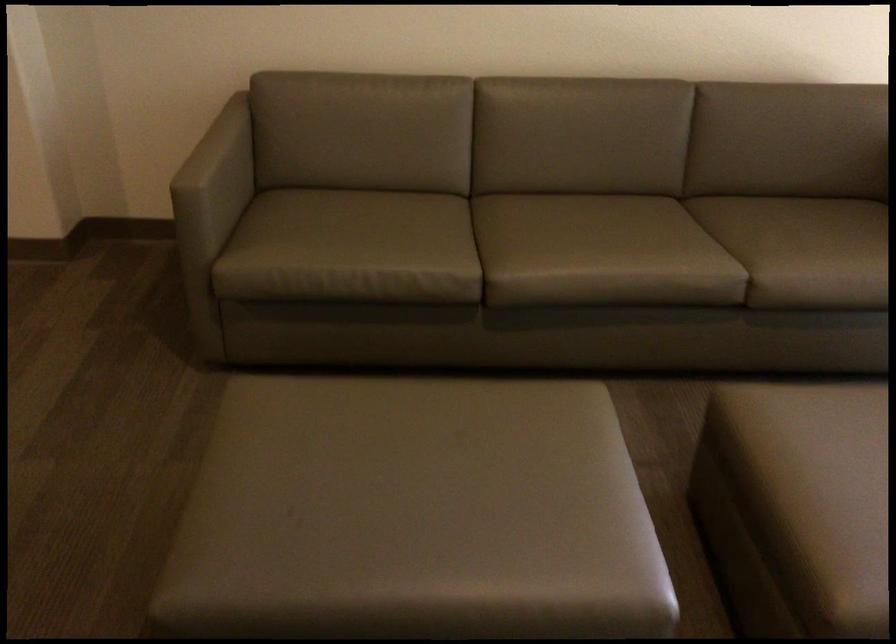
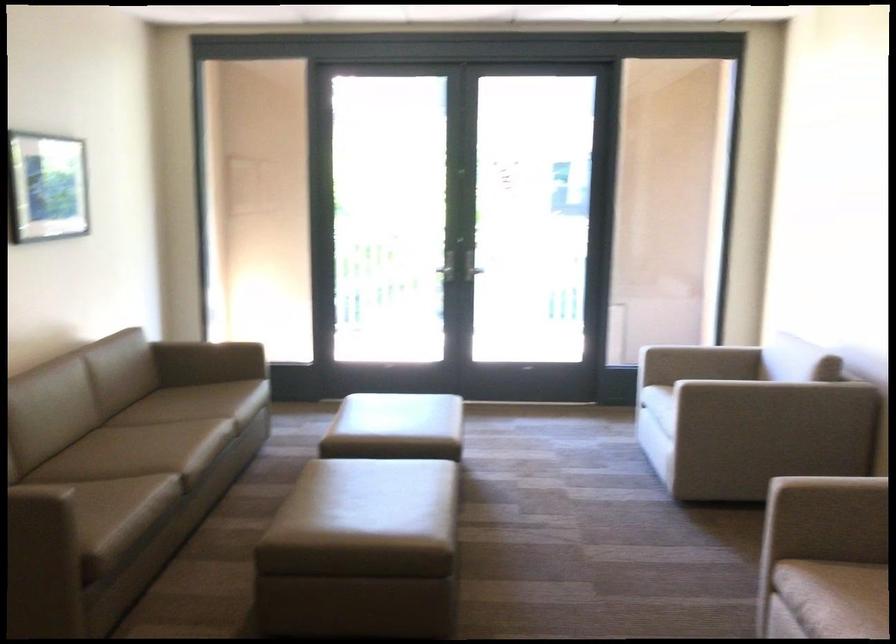
Where in the second image is the point corresponding to the point at 789,198 from the first image?

(122, 399)